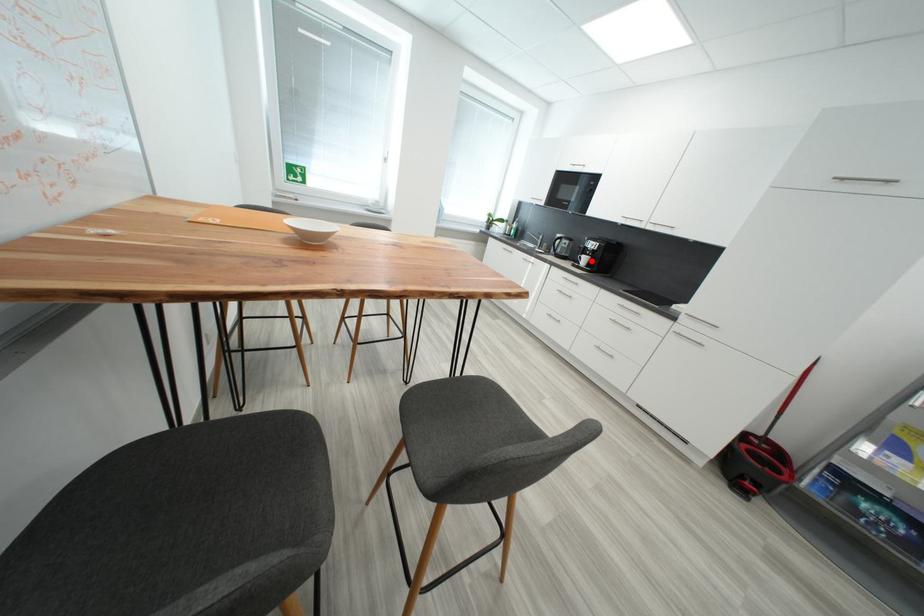
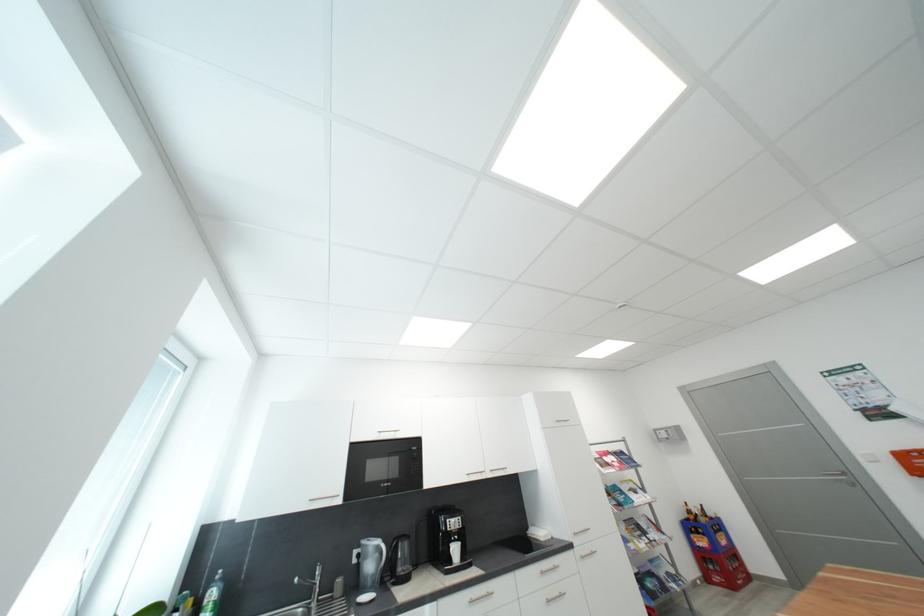
Question: I am providing you with two images of the same scene from different viewpoints. A red point is marked on the first image. Can you still see the location of the red point in image 2?

Choices:
 (A) Yes
 (B) No

Answer: (A)